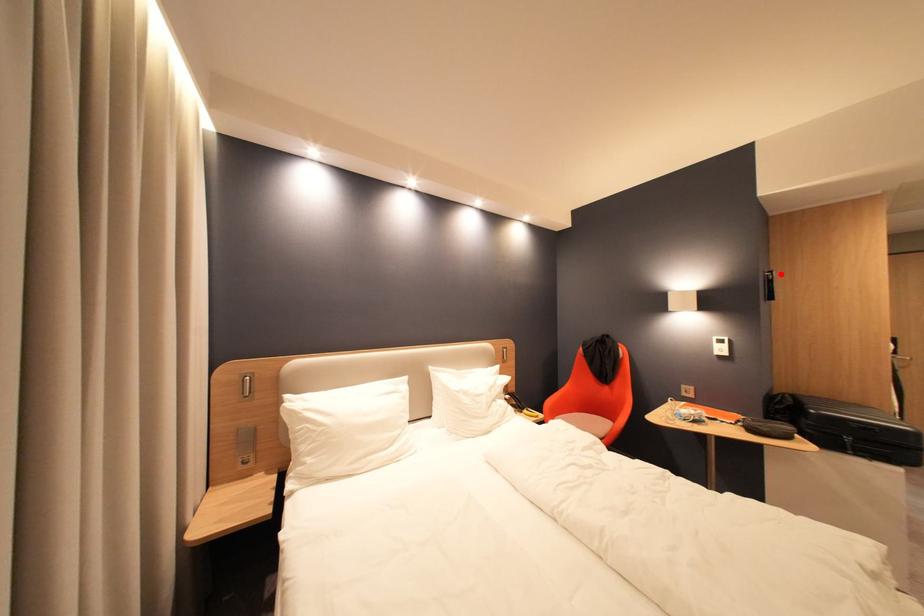
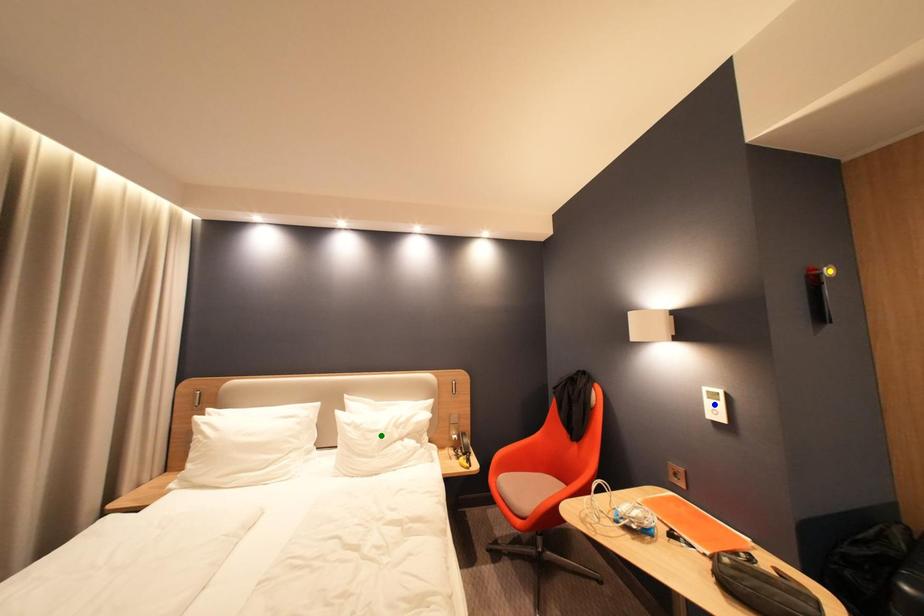
Question: I am providing you with two images of the same scene from different viewpoints. A red point is marked on the first image. You are given multiple points on the second image. Can you choose the point in image 2 that corresponds to the point in image 1?

Choices:
 (A) yellow point
 (B) green point
 (C) blue point

Answer: (A)